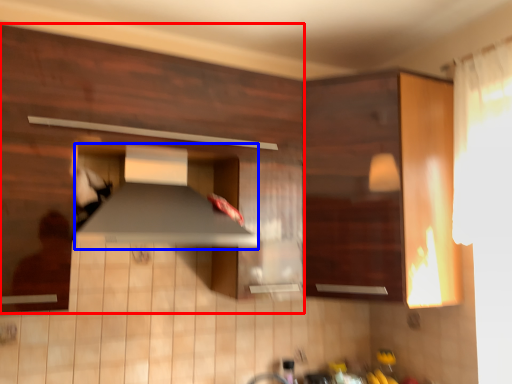
Question: Which of the following is the closest to the observer, cabinetry (highlighted by a red box) or exhaust hood (highlighted by a blue box)?

Choices:
 (A) cabinetry
 (B) exhaust hood

Answer: (A)